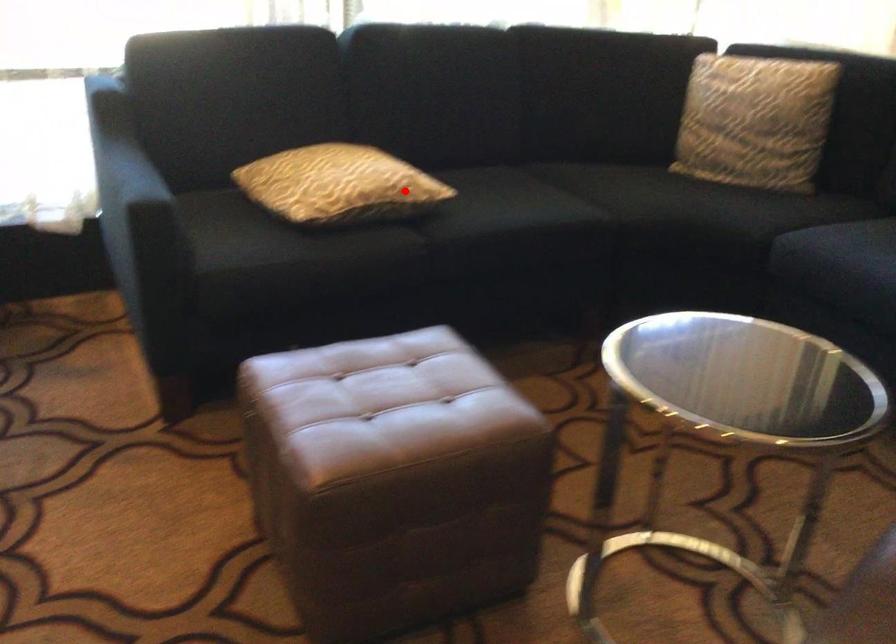
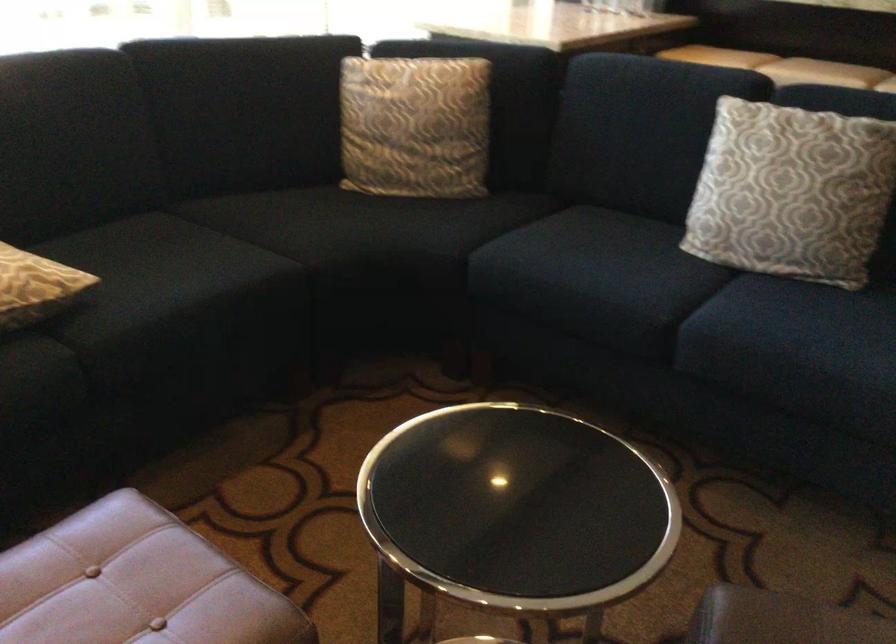
Question: A red point is marked in image1. In image2, is the corresponding 3D point closer to the camera or farther? Reply with the corresponding letter.

Choices:
 (A) The corresponding 3D point is closer.
 (B) The corresponding 3D point is farther.

Answer: (A)